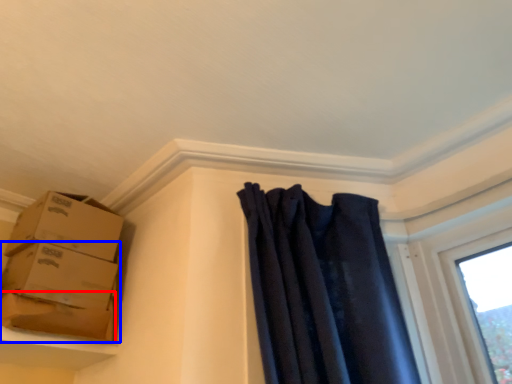
Question: Which of the following is the closest to the observer, cardboard box (highlighted by a red box) or box (highlighted by a blue box)?

Choices:
 (A) cardboard box
 (B) box

Answer: (A)